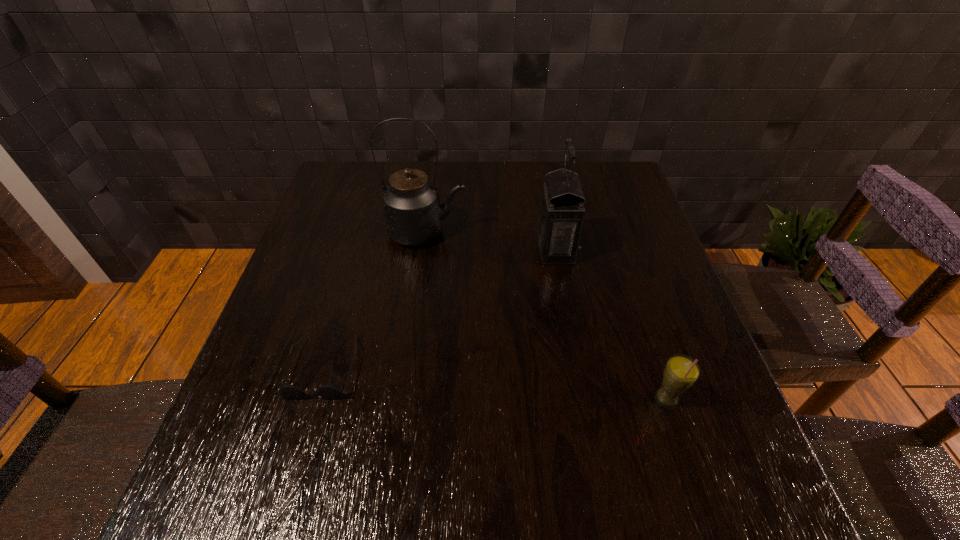
The width and height of the screenshot is (960, 540). What are the coordinates of `free space that satisfies the following two spatial constraints: 1. spout on the kettle; 2. on the left side of the straw for drinking` in the screenshot? It's located at (404, 399).

In order to click on free region that satisfies the following two spatial constraints: 1. on the front-facing side of the third object from left to right; 2. on the right side of the rightmost object in this screenshot , I will do `click(583, 399)`.